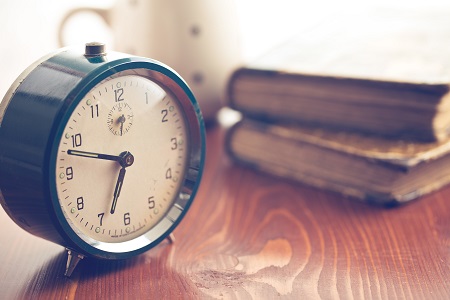
Identify the location of book. The image size is (450, 300). (388, 100), (360, 169).